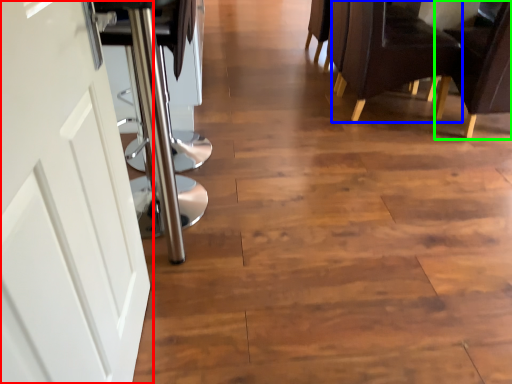
Question: Estimate the real-world distances between objects in this image. Which object is closer to door (highlighted by a red box), chair (highlighted by a blue box) or chair (highlighted by a green box)?

Choices:
 (A) chair
 (B) chair

Answer: (A)